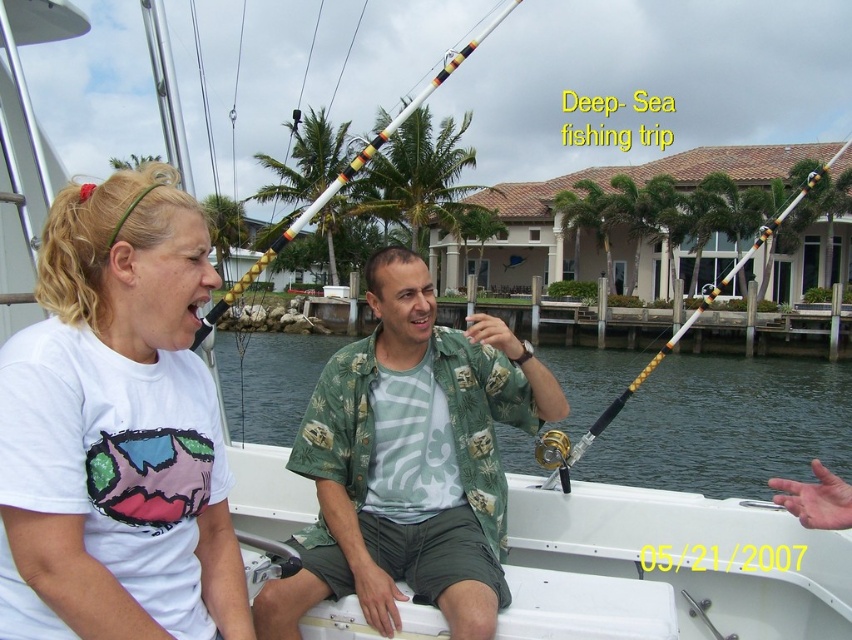
You are standing on the deck of the boat and looking down. Which object is closer to you, the clear water at center or the white plastic fishing rod at center?

The white plastic fishing rod at center is closer to you because the clear water at center is further away.

You are standing on the white boat and looking at two points marked on the boat. Which point is closer to you, point (278, 250) or point (772, 230)?

Point (278, 250) is closer to the viewer than point (772, 230).

You are on a boat and need to choose between the white plastic fishing rod at center and the gold metallic fishing pole at upper center. Which one is taller?

The white plastic fishing rod at center is taller than the gold metallic fishing pole at upper center.